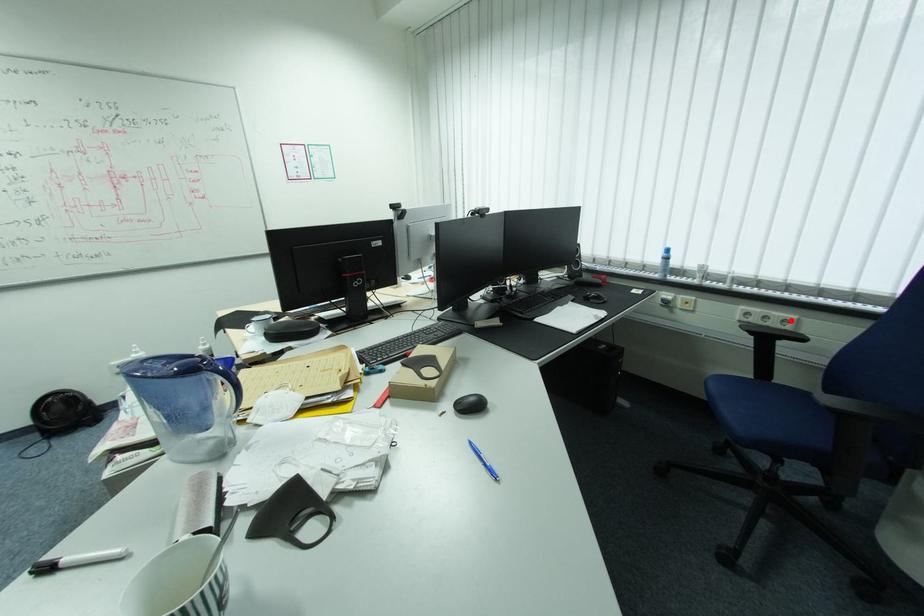
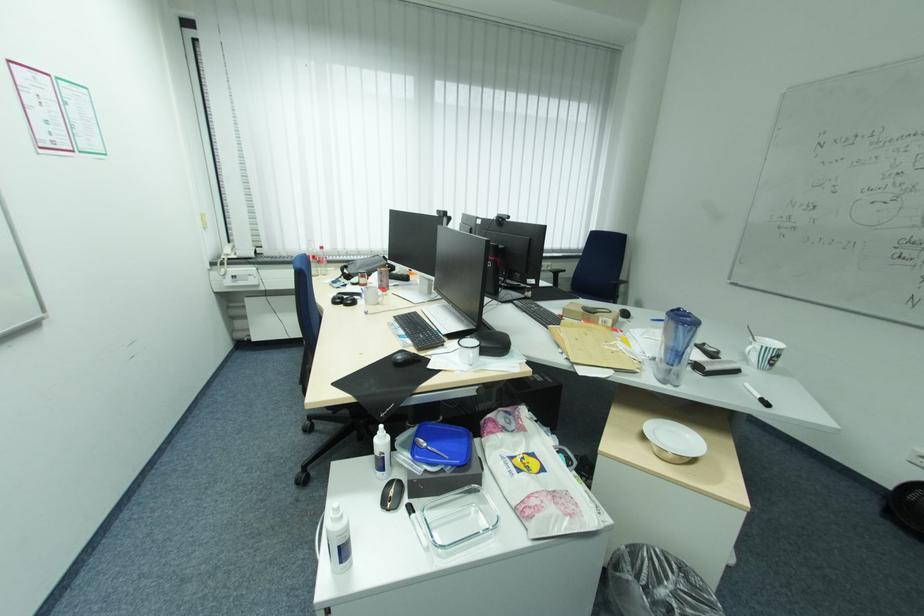
In the second image, find the point that corresponds to the highlighted location in the first image.

(554, 265)